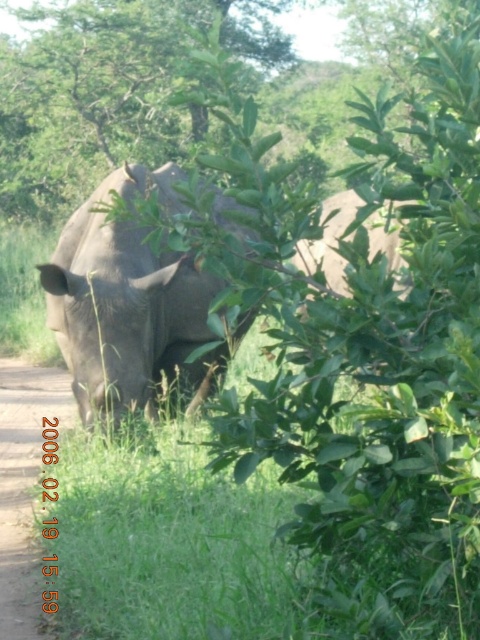
Question: Does gray matte rhinoceros at center have a lesser width compared to dirt path at lower left?

Choices:
 (A) yes
 (B) no

Answer: (B)

Question: Which point appears farthest from the camera in this image?

Choices:
 (A) (0, 621)
 (B) (115, 372)

Answer: (B)

Question: In this image, where is gray matte rhinoceros at center located relative to dirt path at lower left?

Choices:
 (A) left
 (B) right

Answer: (B)

Question: Can you confirm if gray matte rhinoceros at center is smaller than dirt path at lower left?

Choices:
 (A) yes
 (B) no

Answer: (B)